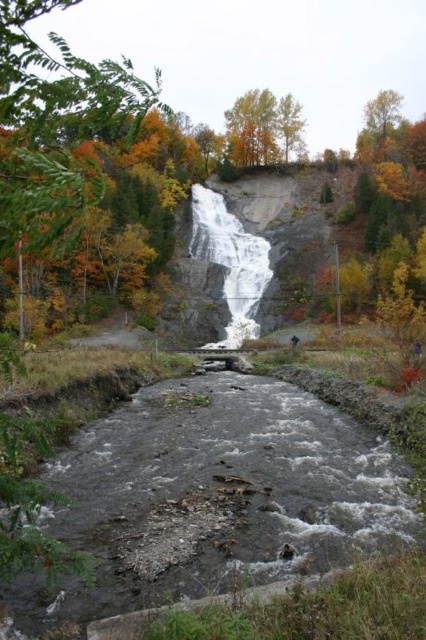
You are standing at the edge of the stream in the autumnal landscape scene. You want to walk to the gray rock waterfall at center. Considering the distance, is it possible to walk directly to the waterfall without crossing any obstacles?

The gray rock waterfall at center is 199.09 feet away from the viewer. Since this distance is quite large, it would be challenging to walk directly to the waterfall without encountering any obstacles such as the rocky terrain, dense foliage, or the cascading water itself. It would be advisable to follow a safer path or trail if available.